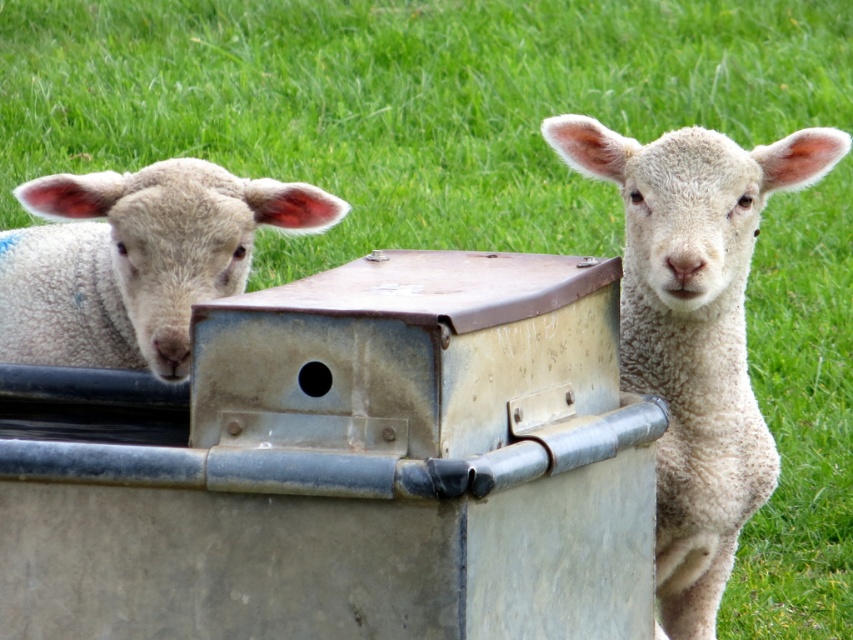
Question: Is white woolen lamb at center thinner than white woolen lamb at left?

Choices:
 (A) no
 (B) yes

Answer: (B)

Question: Which object appears closest to the camera in this image?

Choices:
 (A) white woolen lamb at center
 (B) white woolen lamb at left

Answer: (B)

Question: Does white woolen lamb at center have a lesser width compared to white woolen lamb at left?

Choices:
 (A) yes
 (B) no

Answer: (A)

Question: Can you confirm if white woolen lamb at center is positioned to the left of white woolen lamb at left?

Choices:
 (A) yes
 (B) no

Answer: (B)

Question: Which point appears closest to the camera in this image?

Choices:
 (A) (219, 188)
 (B) (631, 353)

Answer: (A)